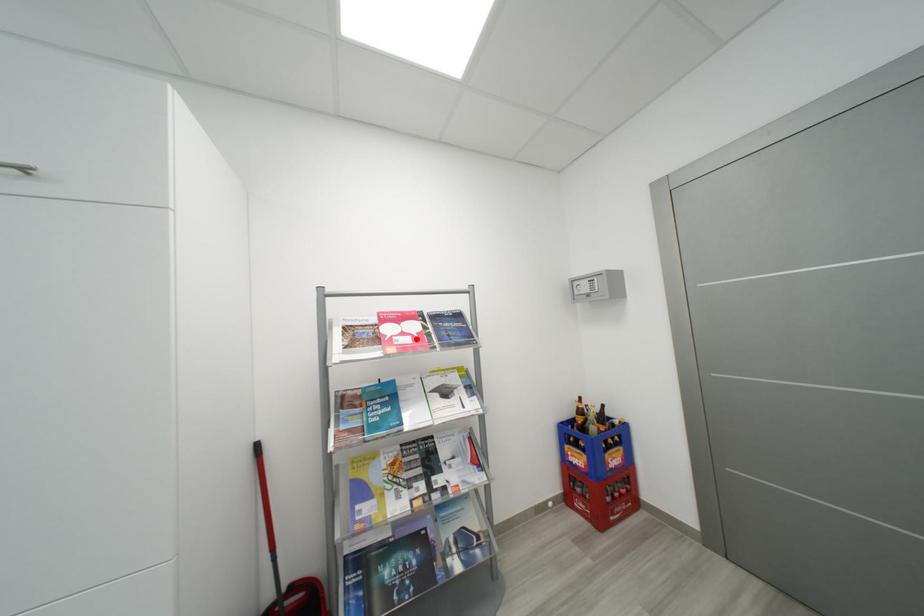
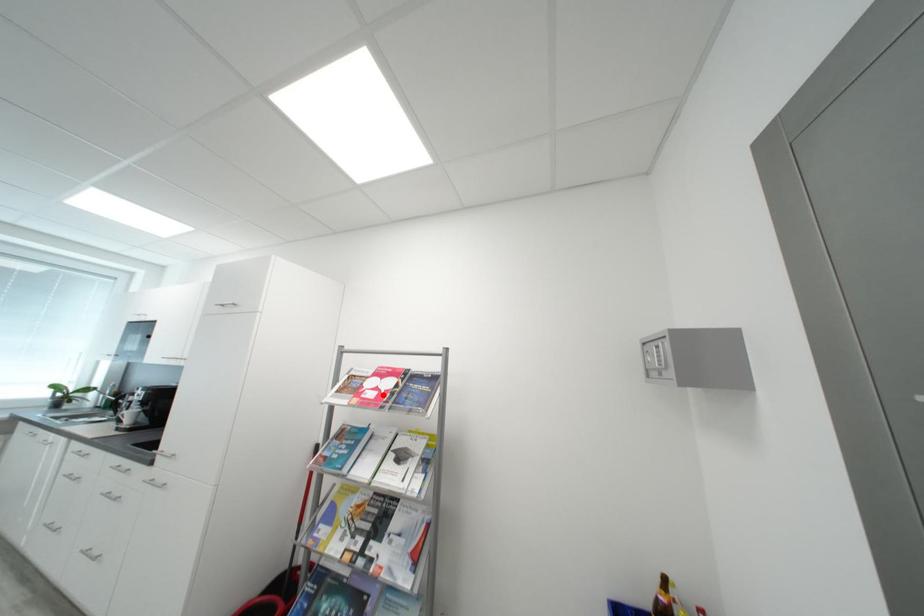
I am providing you with two images of the same scene from different viewpoints. A red point is marked on the first image and another point is marked on the second image. Do the highlighted points in image1 and image2 indicate the same real-world spot?

Yes